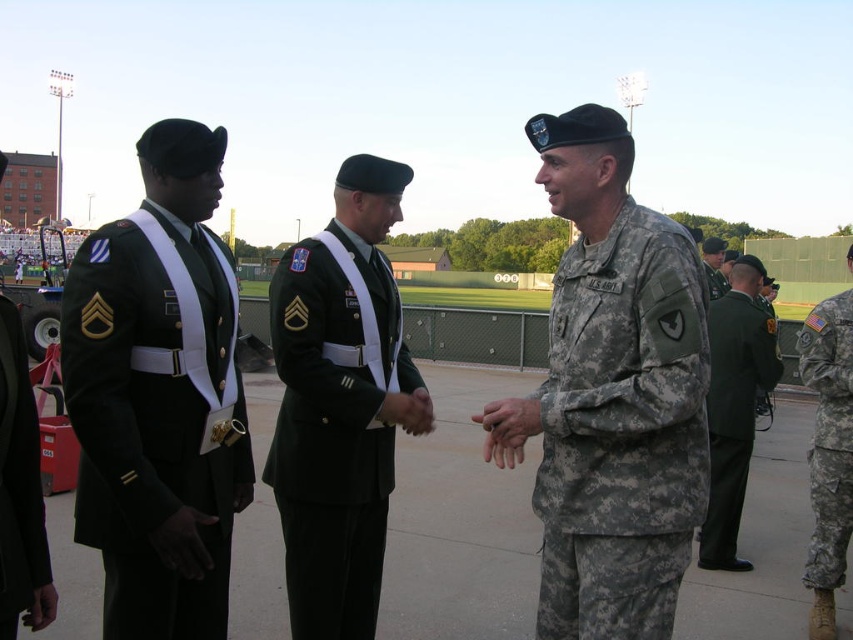
You are a photographer at the event and need to capture a photo of both the camouflage fabric uniform at center and the dark green fabric uniform at left. Based on their positions, which uniform is positioned lower in the frame?

The camouflage fabric uniform at center is positioned lower in the frame than the dark green fabric uniform at left.

You are a photographer positioned at the center of the sports field. You need to take a photo of both the camouflage fabric uniform at center and the camouflage fabric uniform at right. Given that your camera has a maximum focus range of 7 feet, will you be able to capture both subjects in focus?

The camouflage fabric uniform at center is 7.33 feet away from the camouflage fabric uniform at right. Since the distance between them is slightly over the camera maximum focus range of 7 feet, you won wait be able to capture both subjects in focus.